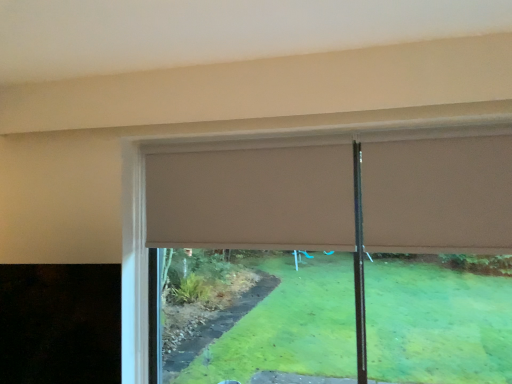
Where is `beige fabric curtain at upper center, which appears as the first curtain when viewed from the front`? beige fabric curtain at upper center, which appears as the first curtain when viewed from the front is located at coordinates (438, 195).

Describe the element at coordinates (438, 195) in the screenshot. This screenshot has height=384, width=512. I see `beige fabric curtain at upper center, placed as the 2th curtain when sorted from left to right` at that location.

Find the location of a particular element. beige fabric curtain at upper center, the first curtain from the left is located at coordinates (252, 198).

This screenshot has height=384, width=512. What do you see at coordinates (252, 198) in the screenshot? I see `beige fabric curtain at upper center, which ranks as the second curtain in front-to-back order` at bounding box center [252, 198].

Identify the location of beige fabric curtain at upper center, placed as the 2th curtain when sorted from left to right. (438, 195).

Which is more to the right, beige fabric curtain at upper center, which ranks as the 2th curtain in back-to-front order, or beige fabric curtain at upper center, which ranks as the second curtain in front-to-back order?

beige fabric curtain at upper center, which ranks as the 2th curtain in back-to-front order.

Is the position of beige fabric curtain at upper center, placed as the 2th curtain when sorted from left to right, more distant than that of beige fabric curtain at upper center, the second curtain when ordered from right to left?

No.

Is point (469, 219) farther from camera compared to point (309, 204)?

No, (469, 219) is closer to viewer.

From the image's perspective, is beige fabric curtain at upper center, which ranks as the 2th curtain in back-to-front order, positioned above or below beige fabric curtain at upper center, which is counted as the first curtain, starting from the back?

From the image's perspective, beige fabric curtain at upper center, which ranks as the 2th curtain in back-to-front order, appears above beige fabric curtain at upper center, which is counted as the first curtain, starting from the back.

From a real-world perspective, is beige fabric curtain at upper center, which appears as the first curtain when viewed from the front, on top of beige fabric curtain at upper center, which ranks as the second curtain in front-to-back order?

Yes, from a real-world perspective, beige fabric curtain at upper center, which appears as the first curtain when viewed from the front, is over beige fabric curtain at upper center, which ranks as the second curtain in front-to-back order

Can you confirm if beige fabric curtain at upper center, the first curtain positioned from the right, is wider than beige fabric curtain at upper center, which ranks as the second curtain in front-to-back order?

Yes.

Which of these two, beige fabric curtain at upper center, which ranks as the 2th curtain in back-to-front order, or beige fabric curtain at upper center, the second curtain when ordered from right to left, stands taller?

beige fabric curtain at upper center, the second curtain when ordered from right to left, is taller.

Between beige fabric curtain at upper center, the first curtain positioned from the right, and beige fabric curtain at upper center, the first curtain from the left, which one has smaller size?

Smaller between the two is beige fabric curtain at upper center, the first curtain positioned from the right.

Can beige fabric curtain at upper center, the second curtain when ordered from right to left, be found inside beige fabric curtain at upper center, the first curtain positioned from the right?

No, beige fabric curtain at upper center, the first curtain positioned from the right, does not contain beige fabric curtain at upper center, the second curtain when ordered from right to left.

Is beige fabric curtain at upper center, which ranks as the 2th curtain in back-to-front order, not close to beige fabric curtain at upper center, the second curtain when ordered from right to left?

No, beige fabric curtain at upper center, which ranks as the 2th curtain in back-to-front order, is not far from beige fabric curtain at upper center, the second curtain when ordered from right to left.

Is beige fabric curtain at upper center, which appears as the first curtain when viewed from the front, oriented away from beige fabric curtain at upper center, which is counted as the first curtain, starting from the back?

No.

Can you tell me how much beige fabric curtain at upper center, the first curtain positioned from the right, and beige fabric curtain at upper center, the second curtain when ordered from right to left, differ in facing direction?

They differ by 0.162 degrees in their facing directions.

How much distance is there between beige fabric curtain at upper center, placed as the 2th curtain when sorted from left to right, and beige fabric curtain at upper center, which is counted as the first curtain, starting from the back?

beige fabric curtain at upper center, placed as the 2th curtain when sorted from left to right, and beige fabric curtain at upper center, which is counted as the first curtain, starting from the back, are 19.28 inches apart.

Locate an element on the screen. curtain below the beige fabric curtain at upper center, which appears as the first curtain when viewed from the front (from a real-world perspective) is located at coordinates (252, 198).

Between beige fabric curtain at upper center, the first curtain from the left, and beige fabric curtain at upper center, which ranks as the 2th curtain in back-to-front order, which one appears on the right side from the viewer's perspective?

beige fabric curtain at upper center, which ranks as the 2th curtain in back-to-front order.

Is beige fabric curtain at upper center, which is counted as the first curtain, starting from the back, in front of or behind beige fabric curtain at upper center, placed as the 2th curtain when sorted from left to right, in the image?

Visually, beige fabric curtain at upper center, which is counted as the first curtain, starting from the back, is located behind beige fabric curtain at upper center, placed as the 2th curtain when sorted from left to right.

Does point (334, 242) appear closer or farther from the camera than point (431, 169)?

Point (334, 242).

In the scene shown: From the image's perspective, is beige fabric curtain at upper center, the first curtain from the left, positioned above or below beige fabric curtain at upper center, which appears as the first curtain when viewed from the front?

beige fabric curtain at upper center, the first curtain from the left, is situated lower than beige fabric curtain at upper center, which appears as the first curtain when viewed from the front, in the image.

From a real-world perspective, is beige fabric curtain at upper center, the second curtain when ordered from right to left, located beneath beige fabric curtain at upper center, the first curtain positioned from the right?

Yes, from a real-world perspective, beige fabric curtain at upper center, the second curtain when ordered from right to left, is under beige fabric curtain at upper center, the first curtain positioned from the right.

Is beige fabric curtain at upper center, which is counted as the first curtain, starting from the back, wider or thinner than beige fabric curtain at upper center, placed as the 2th curtain when sorted from left to right?

Considering their sizes, beige fabric curtain at upper center, which is counted as the first curtain, starting from the back, looks slimmer than beige fabric curtain at upper center, placed as the 2th curtain when sorted from left to right.

Who is taller, beige fabric curtain at upper center, which ranks as the second curtain in front-to-back order, or beige fabric curtain at upper center, which ranks as the 2th curtain in back-to-front order?

beige fabric curtain at upper center, which ranks as the second curtain in front-to-back order.

Considering the sizes of beige fabric curtain at upper center, which is counted as the first curtain, starting from the back, and beige fabric curtain at upper center, which appears as the first curtain when viewed from the front, in the image, is beige fabric curtain at upper center, which is counted as the first curtain, starting from the back, bigger or smaller than beige fabric curtain at upper center, which appears as the first curtain when viewed from the front,?

beige fabric curtain at upper center, which is counted as the first curtain, starting from the back, is bigger than beige fabric curtain at upper center, which appears as the first curtain when viewed from the front.

Is beige fabric curtain at upper center, the second curtain when ordered from right to left, not inside beige fabric curtain at upper center, which ranks as the 2th curtain in back-to-front order?

Yes, beige fabric curtain at upper center, the second curtain when ordered from right to left, is located beyond the bounds of beige fabric curtain at upper center, which ranks as the 2th curtain in back-to-front order.

Is beige fabric curtain at upper center, the second curtain when ordered from right to left, touching beige fabric curtain at upper center, the first curtain positioned from the right?

No, beige fabric curtain at upper center, the second curtain when ordered from right to left, is not touching beige fabric curtain at upper center, the first curtain positioned from the right.

Could you tell me if beige fabric curtain at upper center, the first curtain from the left, is facing beige fabric curtain at upper center, which ranks as the 2th curtain in back-to-front order?

No, beige fabric curtain at upper center, the first curtain from the left, is not facing towards beige fabric curtain at upper center, which ranks as the 2th curtain in back-to-front order.

How many degrees apart are the facing directions of beige fabric curtain at upper center, which is counted as the first curtain, starting from the back, and beige fabric curtain at upper center, the first curtain positioned from the right?

There is a 0.162-degree angle between the facing directions of beige fabric curtain at upper center, which is counted as the first curtain, starting from the back, and beige fabric curtain at upper center, the first curtain positioned from the right.

This screenshot has width=512, height=384. What are the coordinates of `curtain in front of the beige fabric curtain at upper center, the second curtain when ordered from right to left` in the screenshot? It's located at (438, 195).

Find the location of a particular element. The image size is (512, 384). curtain located in front of the beige fabric curtain at upper center, which is counted as the first curtain, starting from the back is located at coordinates (438, 195).

Locate an element on the screen. curtain above the beige fabric curtain at upper center, the second curtain when ordered from right to left (from the image's perspective) is located at coordinates pyautogui.click(x=438, y=195).